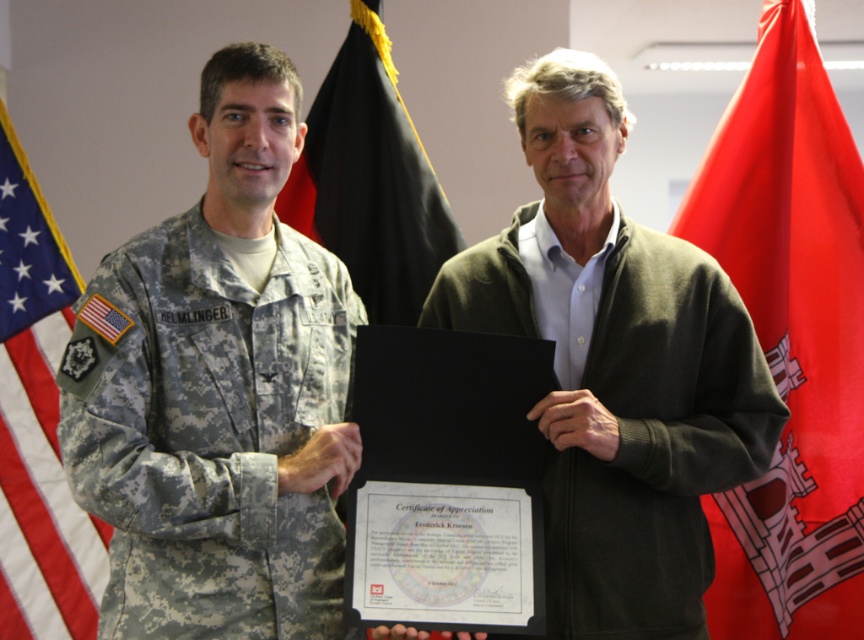
Question: Based on their relative distances, which object is nearer to the red fabric flag at right?

Choices:
 (A) green matte sweater at center
 (B) black fabric flag at center

Answer: (A)

Question: Can you confirm if red fabric flag at right is positioned below american flag at left?

Choices:
 (A) no
 (B) yes

Answer: (A)

Question: Does camouflage fabric uniform at left appear under american flag at left?

Choices:
 (A) no
 (B) yes

Answer: (B)

Question: Among these points, which one is farthest from the camera?

Choices:
 (A) (37, 243)
 (B) (395, 195)
 (C) (321, 256)
 (D) (668, 241)

Answer: (A)

Question: Can you confirm if red fabric flag at right is positioned above american flag at left?

Choices:
 (A) no
 (B) yes

Answer: (B)

Question: Which object is farther from the camera taking this photo?

Choices:
 (A) camouflage fabric uniform at left
 (B) black fabric flag at center
 (C) green matte sweater at center
 (D) american flag at left

Answer: (D)